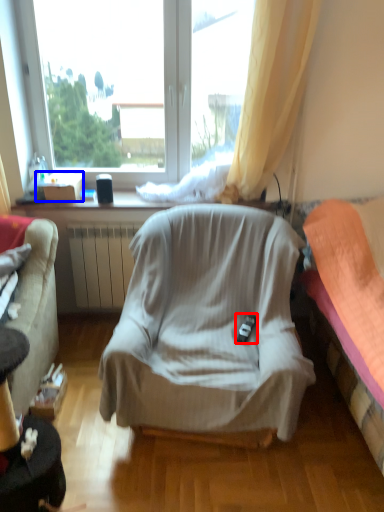
Question: Which object is further to the camera taking this photo, remote control (highlighted by a red box) or box (highlighted by a blue box)?

Choices:
 (A) remote control
 (B) box

Answer: (B)